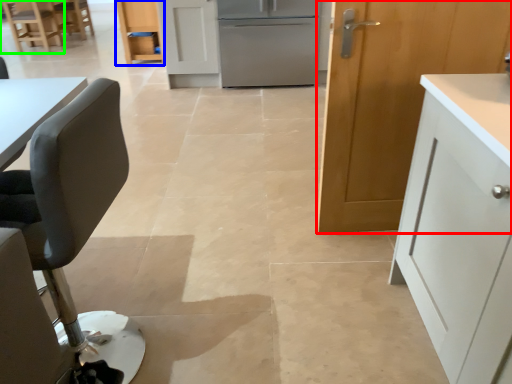
Question: Based on their relative distances, which object is nearer to cabinetry (highlighted by a red box)? Choose from cabinetry (highlighted by a blue box) and chair (highlighted by a green box).

Choices:
 (A) cabinetry
 (B) chair

Answer: (A)